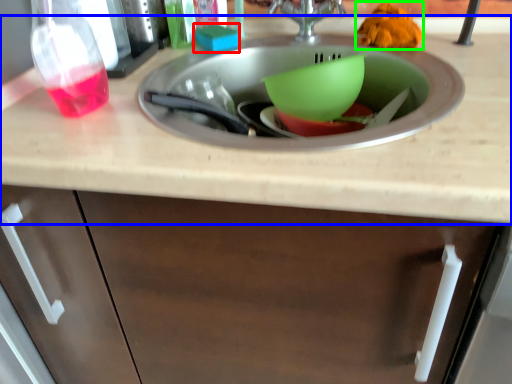
Question: Which object is the farthest from food (highlighted by a red box)? Choose among these: countertop (highlighted by a blue box) or food (highlighted by a green box).

Choices:
 (A) countertop
 (B) food

Answer: (A)